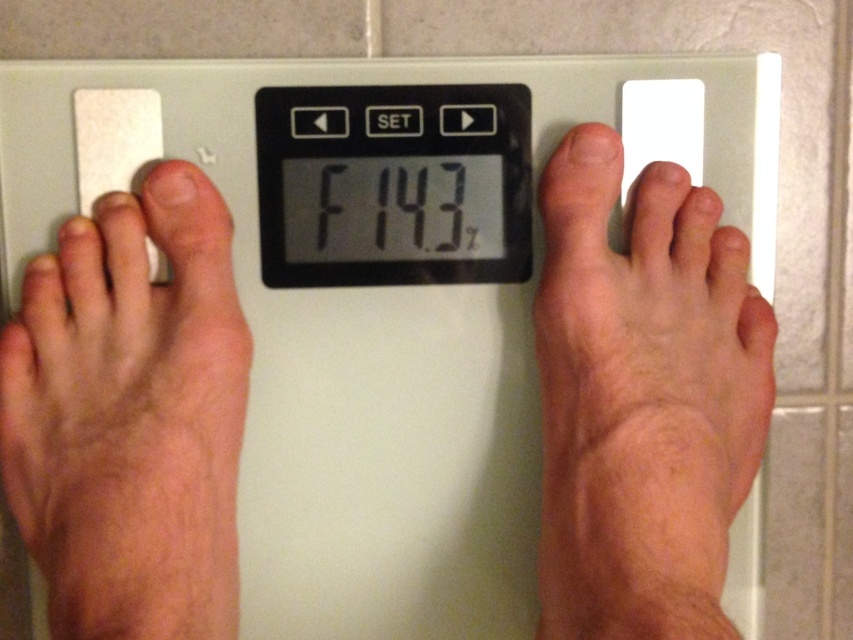
In the scene shown: You are a photographer setting up a shot of the bathroom scale in the image. You need to place a small sticker exactly at point (184,531) on the scale. The sticker is 1 inch in diameter. Will the sticker fit without overlapping any other elements on the scale?

The point (184,531) is 16.46 inches away from the camera. Since the sticker is only 1 inch in diameter, it should fit without overlapping other elements as long as there is sufficient space at that specific coordinate on the scale.

You are a physical therapist advising a patient on proper scale usage. The patient has a smooth skin foot at right and a black plastic scale at center. Based on their current positioning, is the foot positioned correctly for an accurate reading?

The smooth skin foot at right is located below the black plastic scale at center, which means it is not fully on the scale. To ensure an accurate reading, the foot should be placed entirely on the scale surface.

In the scene shown: You are a dermatologist examining a patient in a bathroom. You notice the dry skin at left and the white plastic scale at center. Which object is positioned to the left of the other?

The dry skin at left is positioned to the left of the white plastic scale at center.